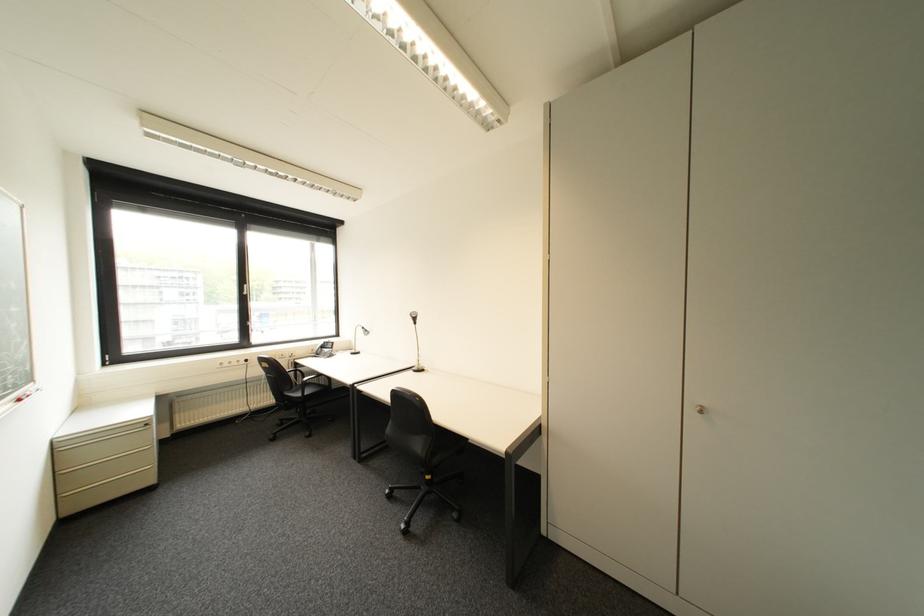
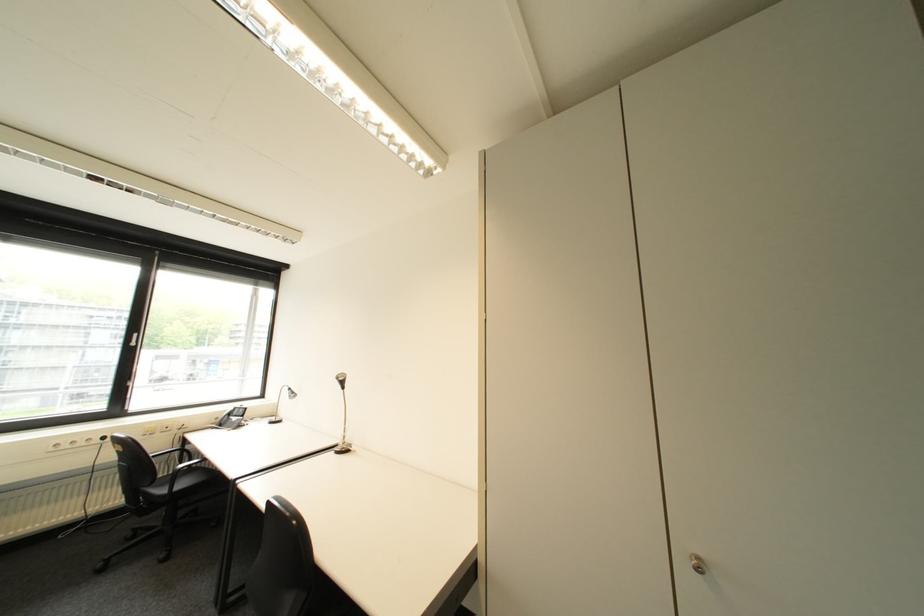
Locate, in the second image, the point that corresponds to the point at 334,342 in the first image.

(246, 408)